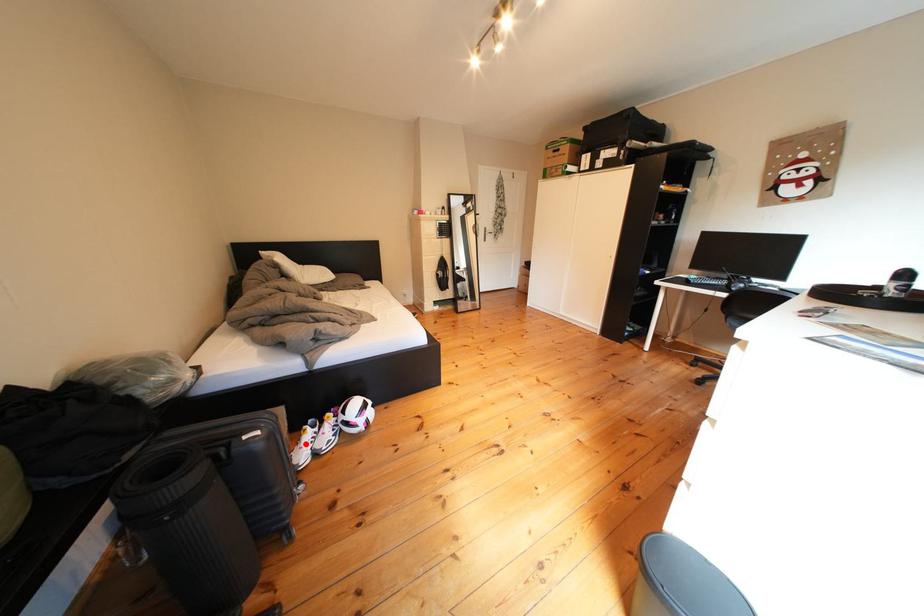
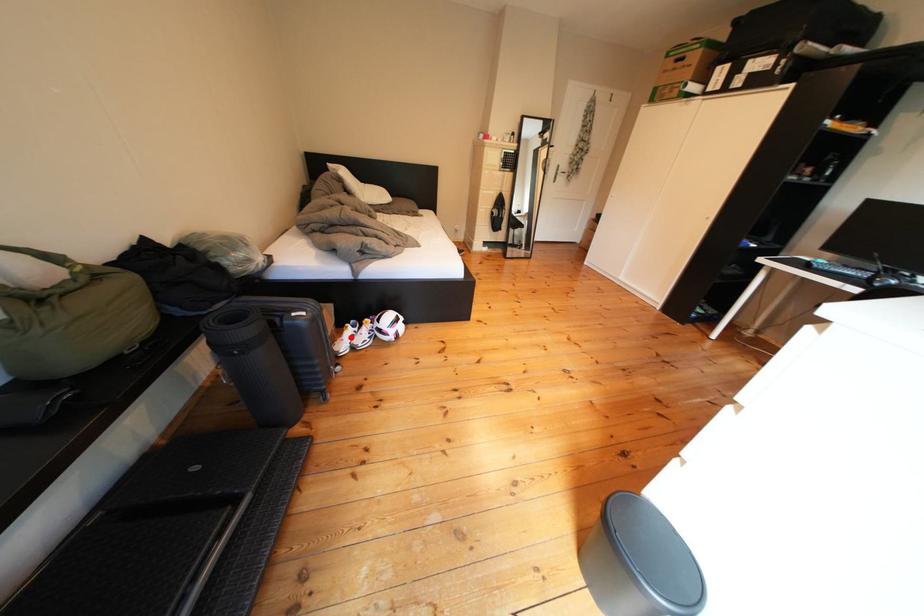
I am providing you with two images of the same scene from different viewpoints. A red point is marked on the first image and another point is marked on the second image. Is the red point in image1 aligned with the point shown in image2?

Yes